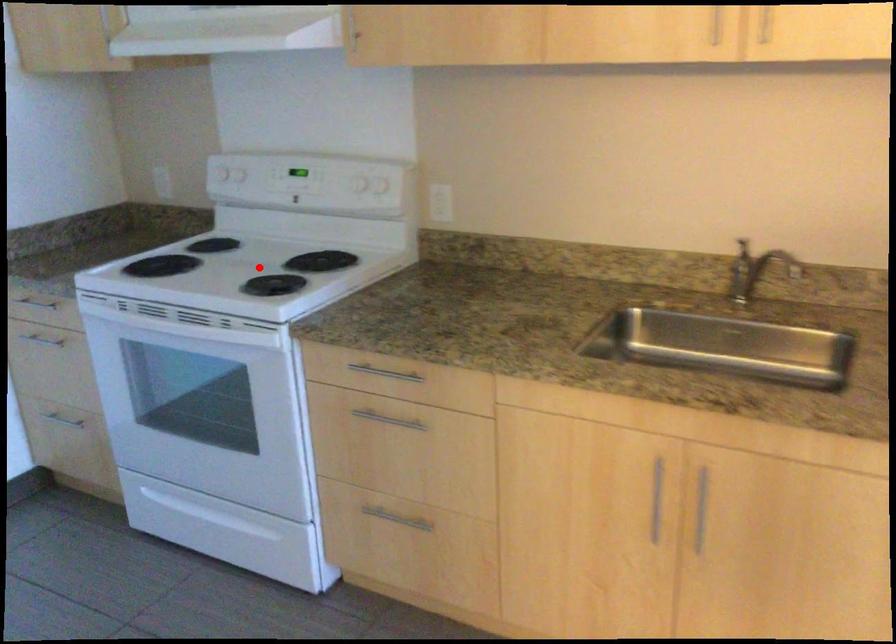
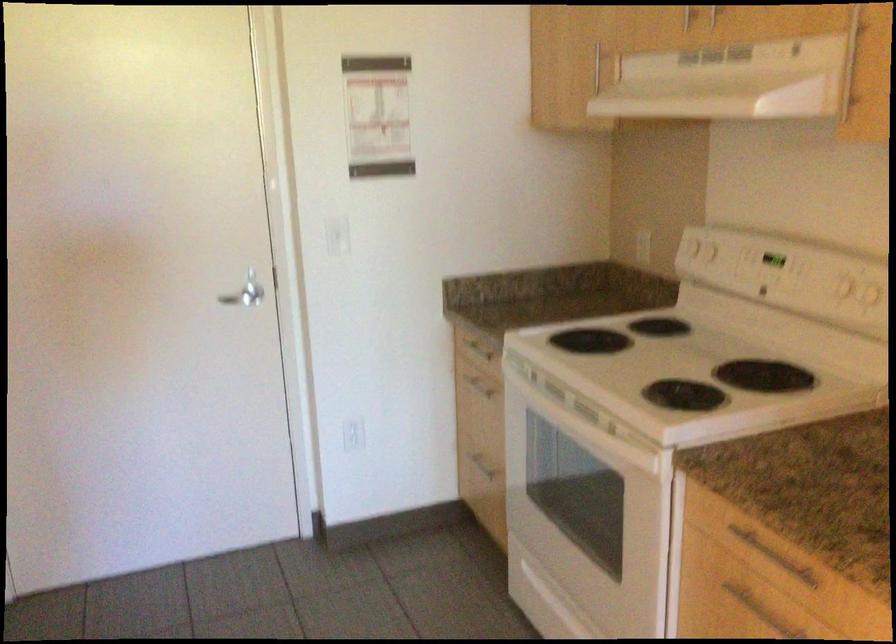
Where in the second image is the point corresponding to the highlighted location from the first image?

(686, 365)